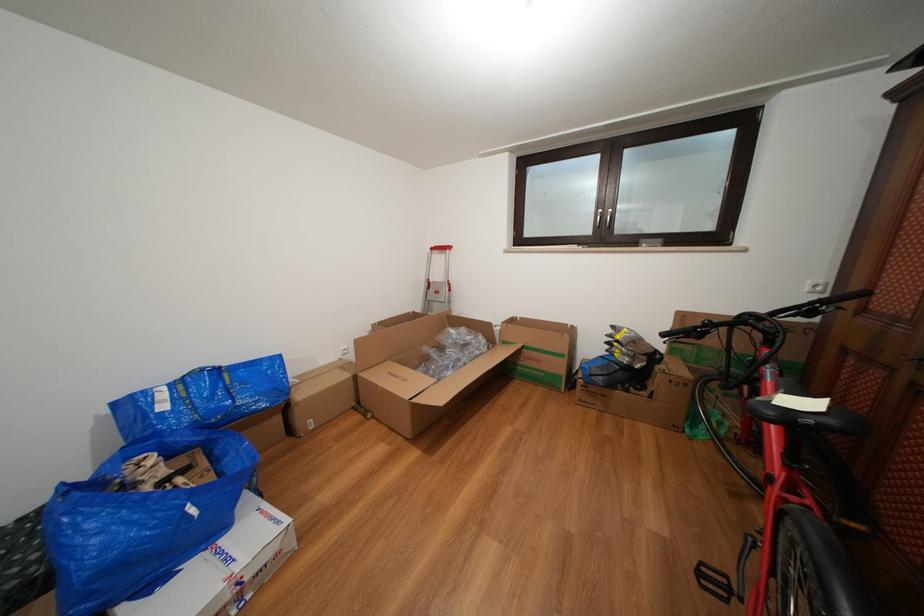
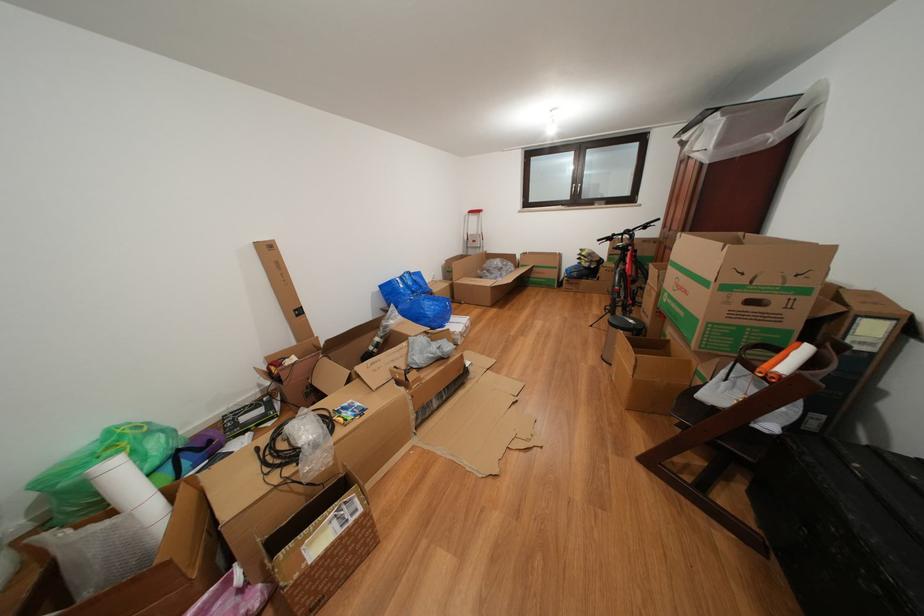
In the second image, find the point that corresponds to point (499, 330) in the first image.

(523, 261)